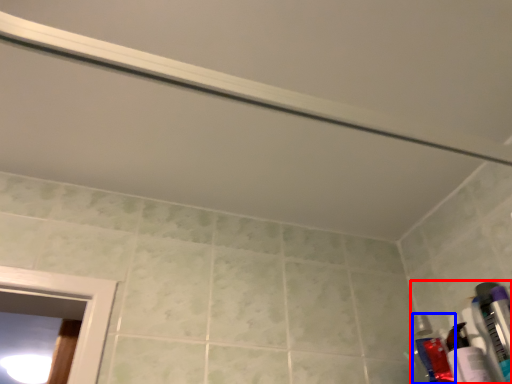
Question: Which object appears closest to the camera in this image, toiletry (highlighted by a red box) or toiletry (highlighted by a blue box)?

Choices:
 (A) toiletry
 (B) toiletry

Answer: (A)